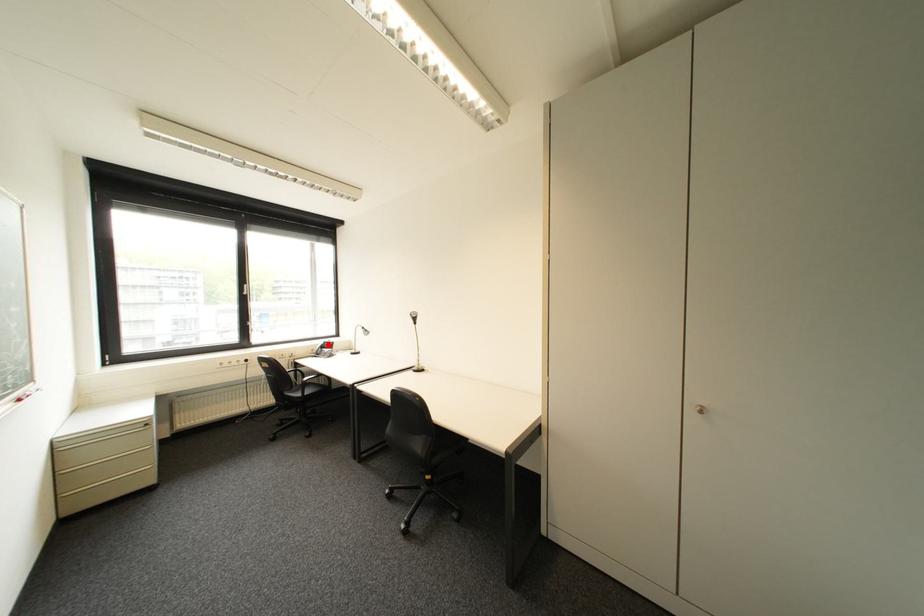
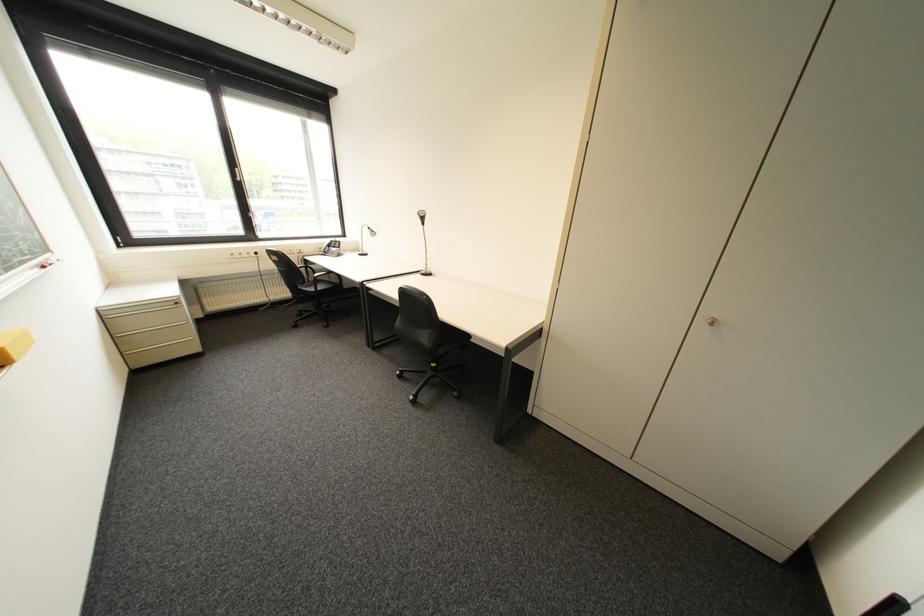
Question: I am providing you with two images of the same scene from different viewpoints. In image1, a red point is highlighted. Considering the same 3D point in image2, which of the following is correct?

Choices:
 (A) It is closer
 (B) It is farther

Answer: (A)